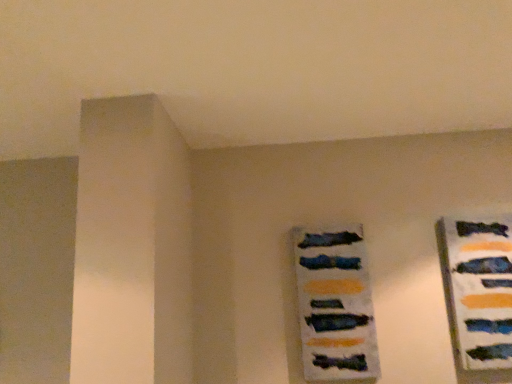
Question: Is the position of matte blue picture frame at center-right more distant than that of matte blue tie at right?

Choices:
 (A) yes
 (B) no

Answer: (A)

Question: Can you confirm if matte blue picture frame at center-right is positioned to the right of matte blue tie at right?

Choices:
 (A) no
 (B) yes

Answer: (A)

Question: From the image's perspective, is matte blue picture frame at center-right on matte blue tie at right?

Choices:
 (A) no
 (B) yes

Answer: (A)

Question: Is matte blue picture frame at center-right taller than matte blue tie at right?

Choices:
 (A) yes
 (B) no

Answer: (B)

Question: Is matte blue picture frame at center-right in front of matte blue tie at right?

Choices:
 (A) yes
 (B) no

Answer: (B)

Question: Can matte blue tie at right be found inside matte blue picture frame at center-right?

Choices:
 (A) yes
 (B) no

Answer: (B)

Question: Does matte blue tie at right have a lesser width compared to matte blue picture frame at center-right?

Choices:
 (A) no
 (B) yes

Answer: (B)

Question: Is matte blue picture frame at center-right surrounded by matte blue tie at right?

Choices:
 (A) yes
 (B) no

Answer: (B)

Question: Is the depth of matte blue tie at right greater than that of matte blue picture frame at center-right?

Choices:
 (A) no
 (B) yes

Answer: (A)

Question: Can you confirm if matte blue tie at right is taller than matte blue picture frame at center-right?

Choices:
 (A) no
 (B) yes

Answer: (B)

Question: Considering the relative positions of matte blue tie at right and matte blue picture frame at center-right in the image provided, is matte blue tie at right to the right of matte blue picture frame at center-right from the viewer's perspective?

Choices:
 (A) no
 (B) yes

Answer: (B)

Question: Is matte blue tie at right positioned beyond the bounds of matte blue picture frame at center-right?

Choices:
 (A) yes
 (B) no

Answer: (A)

Question: In terms of height, does matte blue picture frame at center-right look taller or shorter compared to matte blue tie at right?

Choices:
 (A) short
 (B) tall

Answer: (A)